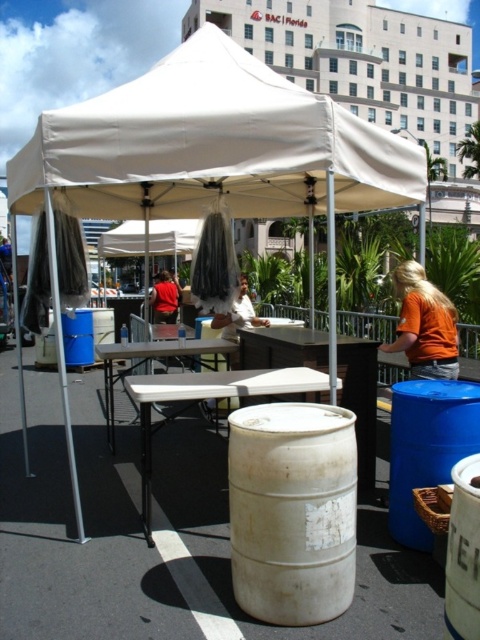
You are planning to place a small potted plant on top of the blue plastic barrel at lower right. Considering the height of the barrel and the person in the matte red shirt at center, will the plant be visible to the person standing at the center?

The blue plastic barrel at lower right has a lesser height compared to matte red shirt at center, so the plant placed on top of the blue plastic barrel at lower right will be shorter than the person in the matte red shirt at center. Therefore, the plant might not be fully visible to the person in the matte red shirt at center unless they bend down or move closer.

You are planning to hang a string of fairy lights from the highest point of the white fabric tent at center to the white plastic table at center. Based on their heights, will the lights need to be lowered significantly at the table end to reach it?

The white fabric tent at center is much taller than the white plastic table at center, so the fairy lights would need to be lowered significantly at the table end to reach it.